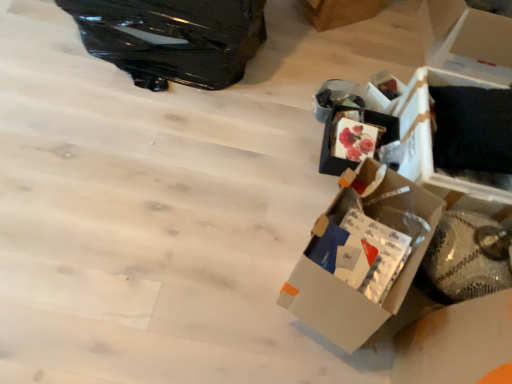
Identify the location of free space in front of glossy black suitcase at upper left. The height and width of the screenshot is (384, 512). (130, 143).